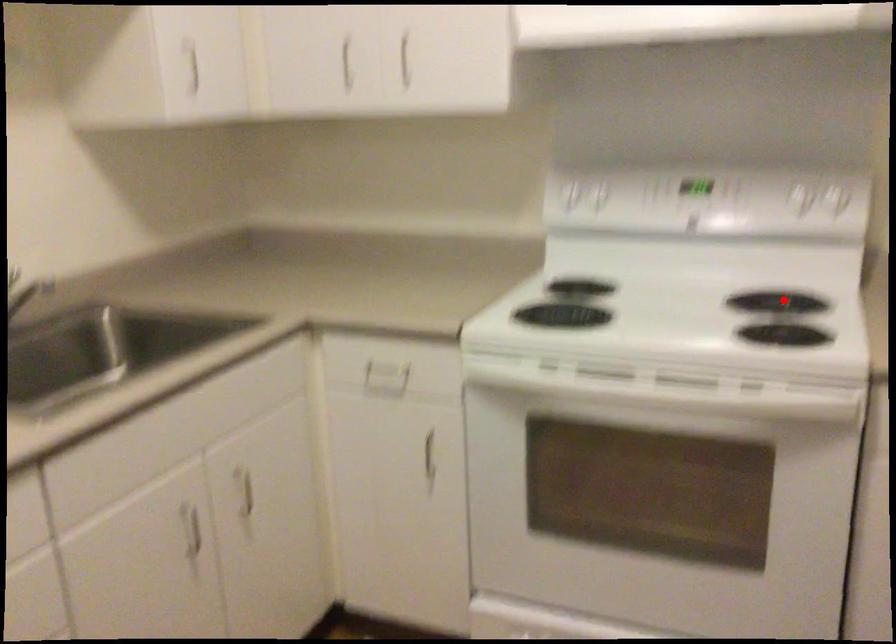
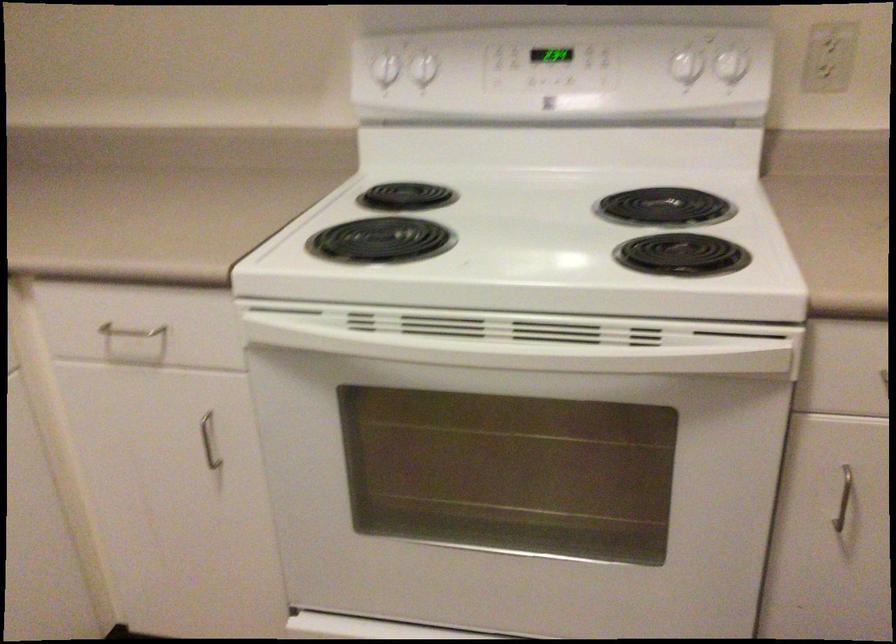
Question: I am providing you with two images of the same scene from different viewpoints. In image1, a red point is highlighted. Considering the same 3D point in image2, which of the following is correct?

Choices:
 (A) It is closer
 (B) It is farther

Answer: (A)